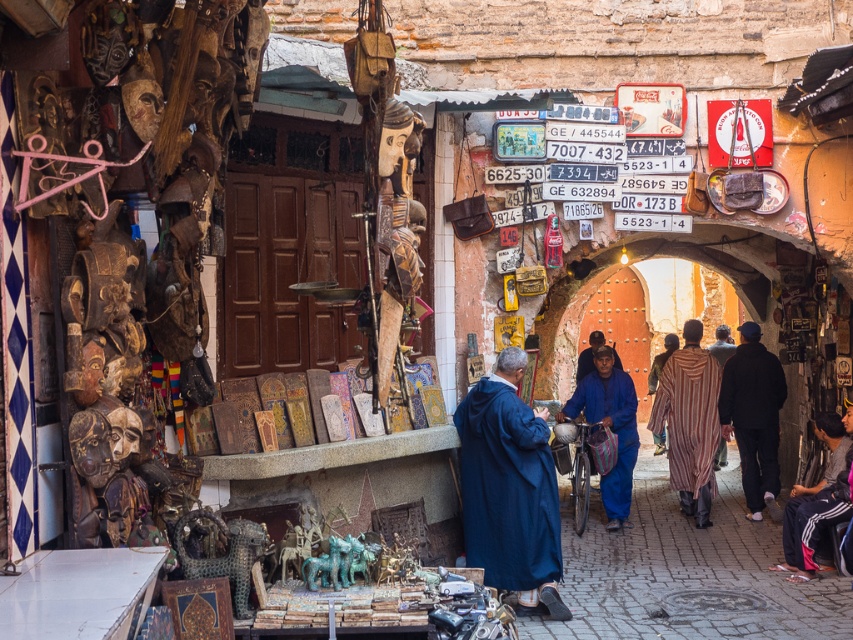
You are a customer in this market and you want to pick up the striped woolen robe at center and the dark blue woolen robe at lower right. Which robe should you look for first if you want to start from the highest position?

The striped woolen robe at center is above the dark blue woolen robe at lower right, so you should look for the striped woolen robe at center first since it is positioned higher.

You are a customer in this market and see two blue robes at center. Which one is positioned lower between the blue cotton robe at center and the blue matte robe at center?

The blue cotton robe at center is positioned lower than the blue matte robe at center.